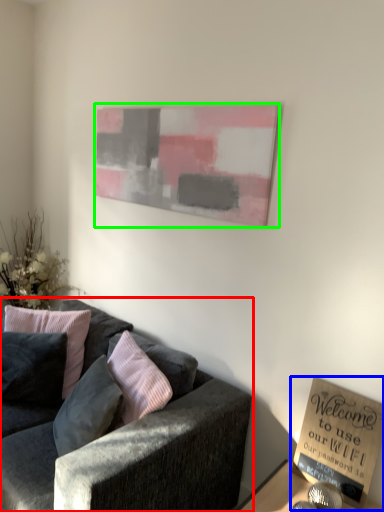
Question: Which is farther away from studio couch (highlighted by a red box)? book (highlighted by a blue box) or picture frame (highlighted by a green box)?

Choices:
 (A) book
 (B) picture frame

Answer: (B)